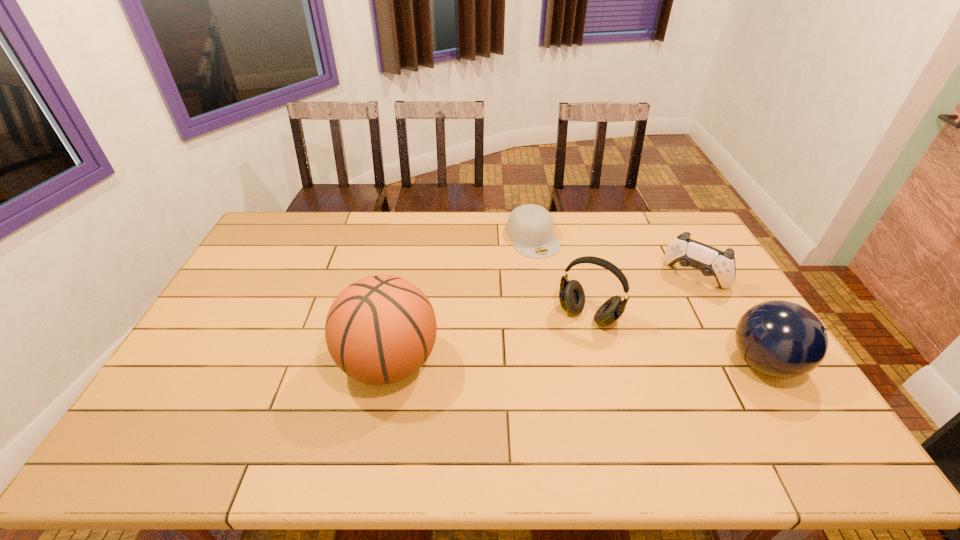
Find the location of a particular element. Image resolution: width=960 pixels, height=540 pixels. the tallest object is located at coordinates (381, 329).

This screenshot has width=960, height=540. Identify the location of the leftmost object. (381, 329).

I want to click on bowling ball, so click(781, 339).

At what (x,y) coordinates should I click in order to perform the action: click on the shortest object. Please return your answer as a coordinate pair (x, y). Looking at the image, I should click on (530, 227).

This screenshot has width=960, height=540. Find the location of `the farthest object`. the farthest object is located at coordinates (530, 227).

Where is `the second farthest object`? This screenshot has width=960, height=540. the second farthest object is located at coordinates (710, 261).

Identify the location of control. (710, 261).

This screenshot has height=540, width=960. Find the location of `headset`. headset is located at coordinates (571, 294).

At what (x,y) coordinates should I click in order to perform the action: click on free space located 0.130m on the back of the leftmost object. Please return your answer as a coordinate pair (x, y). Image resolution: width=960 pixels, height=540 pixels. Looking at the image, I should click on (402, 295).

At what (x,y) coordinates should I click in order to perform the action: click on blank space located on the front-facing side of the cap. Please return your answer as a coordinate pair (x, y). Looking at the image, I should click on (566, 295).